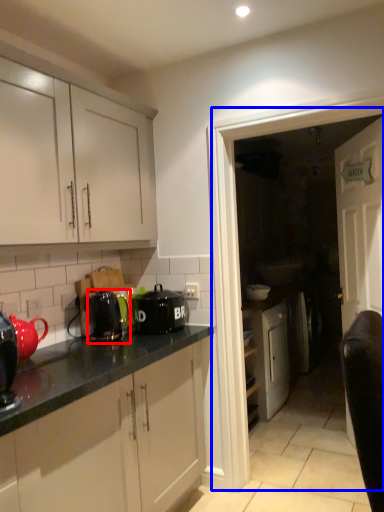
Question: Among these objects, which one is nearest to the camera, kitchen appliance (highlighted by a red box) or glass door (highlighted by a blue box)?

Choices:
 (A) kitchen appliance
 (B) glass door

Answer: (B)